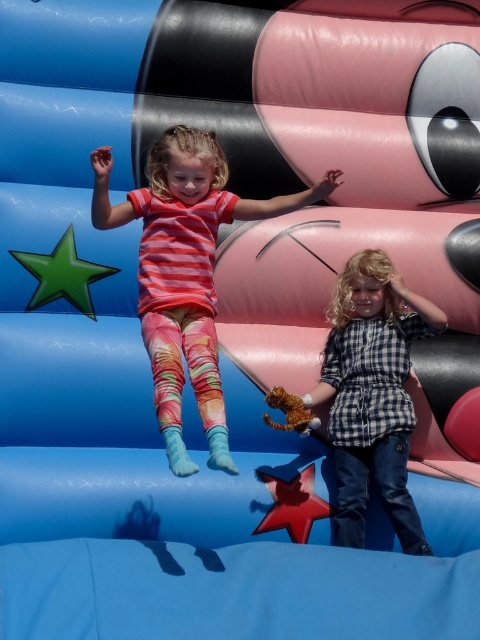
Can you confirm if striped cotton shirt at upper center is thinner than checkered fabric shirt at center?

In fact, striped cotton shirt at upper center might be wider than checkered fabric shirt at center.

Measure the distance from striped cotton shirt at upper center to checkered fabric shirt at center.

They are 1.34 meters apart.

Is point (210, 216) positioned in front of point (388, 417)?

Yes, point (210, 216) is closer to viewer.

You are a GUI agent. You are given a task and a screenshot of the screen. Output one action in this format:
    pyautogui.click(x=<x>, y=<y>)
    Task: Click on the striped cotton shirt at upper center
    Image resolution: width=480 pixels, height=640 pixels.
    Given the screenshot: What is the action you would take?
    point(184,273)